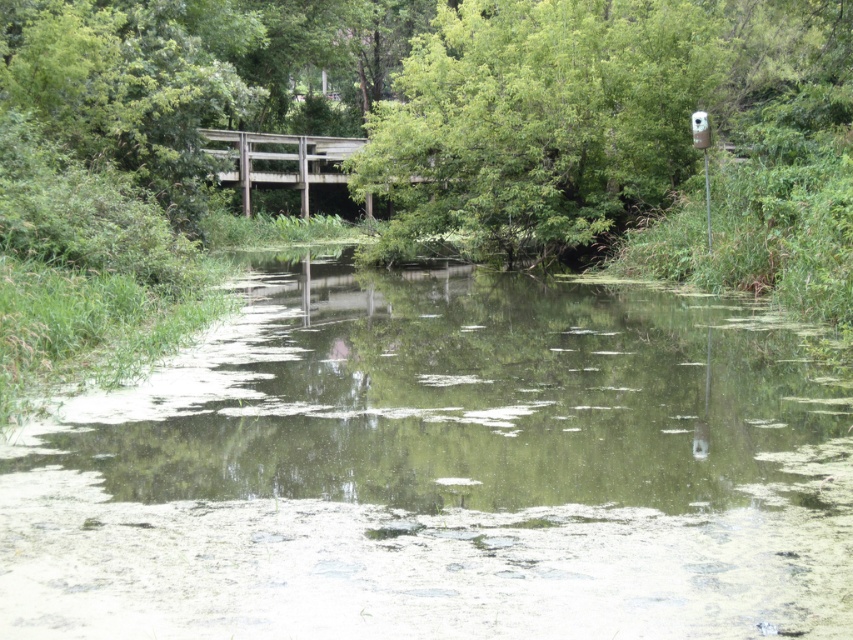
Does green algae-covered water at center appear under weathered wood bridge at center?

Correct, green algae-covered water at center is located below weathered wood bridge at center.

Who is more distant from viewer, (90, 451) or (288, 176)?

The point (288, 176) is more distant.

The height and width of the screenshot is (640, 853). Describe the element at coordinates (442, 470) in the screenshot. I see `green algae-covered water at center` at that location.

Identify the location of green algae-covered water at center. (442, 470).